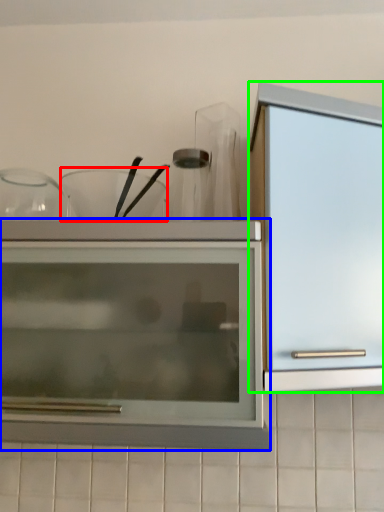
Question: Which is farther away from tableware (highlighted by a red box)? cupboard (highlighted by a blue box) or cabinetry (highlighted by a green box)?

Choices:
 (A) cupboard
 (B) cabinetry

Answer: (B)